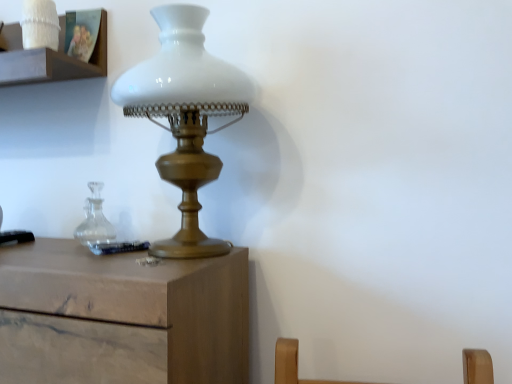
Question: Considering the relative positions of white matte glass lamp at center and white ceramic candle holder at upper left in the image provided, is white matte glass lamp at center to the right of white ceramic candle holder at upper left from the viewer's perspective?

Choices:
 (A) yes
 (B) no

Answer: (A)

Question: Does white matte glass lamp at center have a greater height compared to white ceramic candle holder at upper left?

Choices:
 (A) yes
 (B) no

Answer: (A)

Question: Are white matte glass lamp at center and white ceramic candle holder at upper left making contact?

Choices:
 (A) no
 (B) yes

Answer: (A)

Question: Considering the relative sizes of white matte glass lamp at center and white ceramic candle holder at upper left in the image provided, is white matte glass lamp at center smaller than white ceramic candle holder at upper left?

Choices:
 (A) yes
 (B) no

Answer: (B)

Question: Can you confirm if white matte glass lamp at center is wider than white ceramic candle holder at upper left?

Choices:
 (A) no
 (B) yes

Answer: (B)

Question: From a real-world perspective, is white matte glass lamp at center over white ceramic candle holder at upper left?

Choices:
 (A) yes
 (B) no

Answer: (B)

Question: From the image's perspective, is white ceramic candle holder at upper left above white matte glass lamp at center?

Choices:
 (A) yes
 (B) no

Answer: (A)

Question: Is white ceramic candle holder at upper left taller than white matte glass lamp at center?

Choices:
 (A) no
 (B) yes

Answer: (A)

Question: Does white ceramic candle holder at upper left have a larger size compared to white matte glass lamp at center?

Choices:
 (A) yes
 (B) no

Answer: (B)

Question: Considering the relative positions of white ceramic candle holder at upper left and white matte glass lamp at center in the image provided, is white ceramic candle holder at upper left in front of white matte glass lamp at center?

Choices:
 (A) yes
 (B) no

Answer: (B)

Question: Does white ceramic candle holder at upper left turn towards white matte glass lamp at center?

Choices:
 (A) no
 (B) yes

Answer: (A)

Question: From a real-world perspective, is white ceramic candle holder at upper left on white matte glass lamp at center?

Choices:
 (A) yes
 (B) no

Answer: (A)

Question: Is white matte glass lamp at center wider or thinner than white ceramic candle holder at upper left?

Choices:
 (A) thin
 (B) wide

Answer: (B)